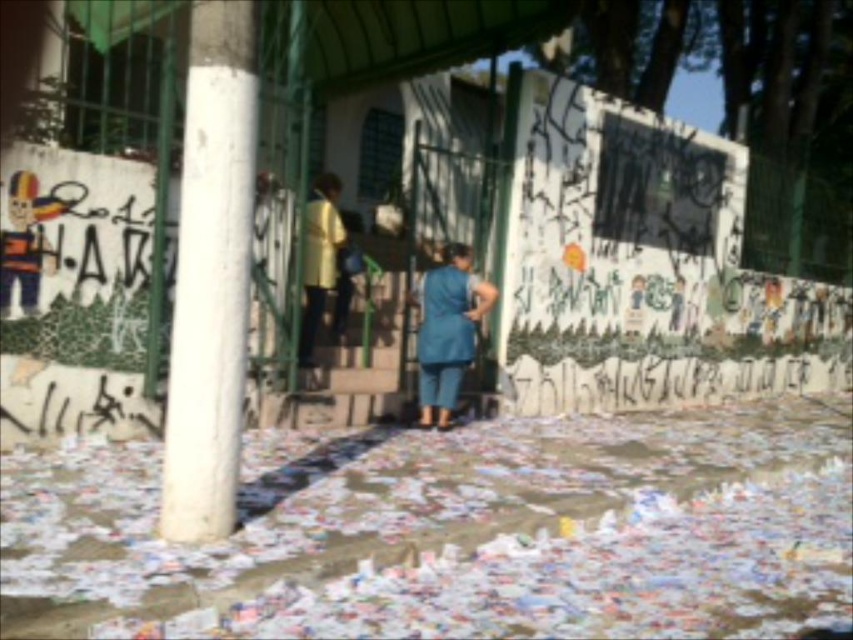
Question: Does white concrete pillar at left have a greater width compared to yellow matte shirt at center?

Choices:
 (A) no
 (B) yes

Answer: (B)

Question: Among these objects, which one is farthest from the camera?

Choices:
 (A) blue fabric dress at center
 (B) white concrete pillar at left
 (C) yellow matte shirt at center

Answer: (A)

Question: Can you confirm if blue fabric dress at center is positioned below yellow matte shirt at center?

Choices:
 (A) no
 (B) yes

Answer: (B)

Question: Among these objects, which one is nearest to the camera?

Choices:
 (A) white concrete pillar at left
 (B) blue fabric dress at center
 (C) yellow matte shirt at center

Answer: (A)

Question: From the image, what is the correct spatial relationship of white concrete pillar at left in relation to yellow matte shirt at center?

Choices:
 (A) right
 (B) left

Answer: (A)

Question: Which point is farther from the camera taking this photo?

Choices:
 (A) (320, 312)
 (B) (465, 253)
 (C) (223, 433)

Answer: (B)